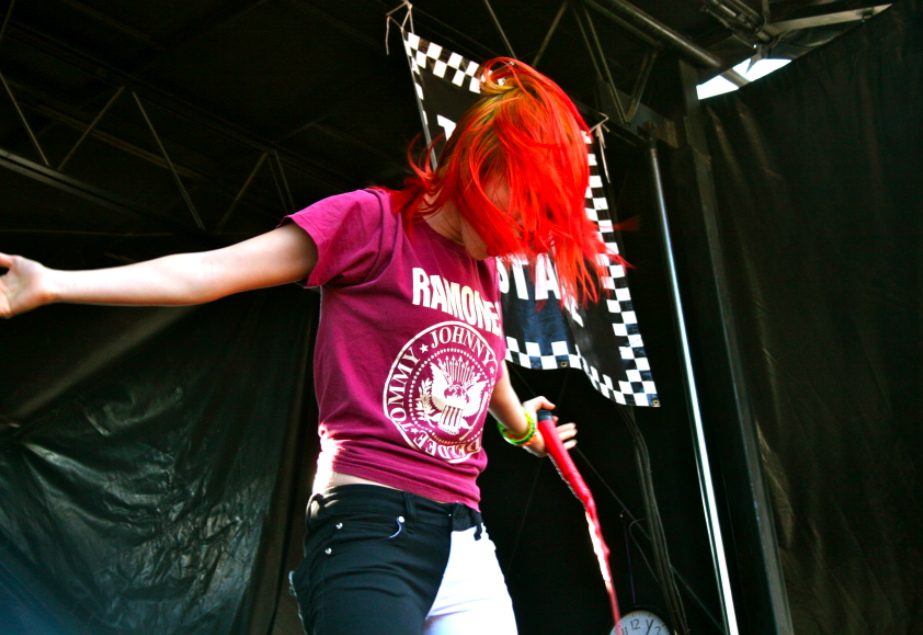
The width and height of the screenshot is (923, 635). Find the location of `wall clock`. wall clock is located at coordinates (641, 630).